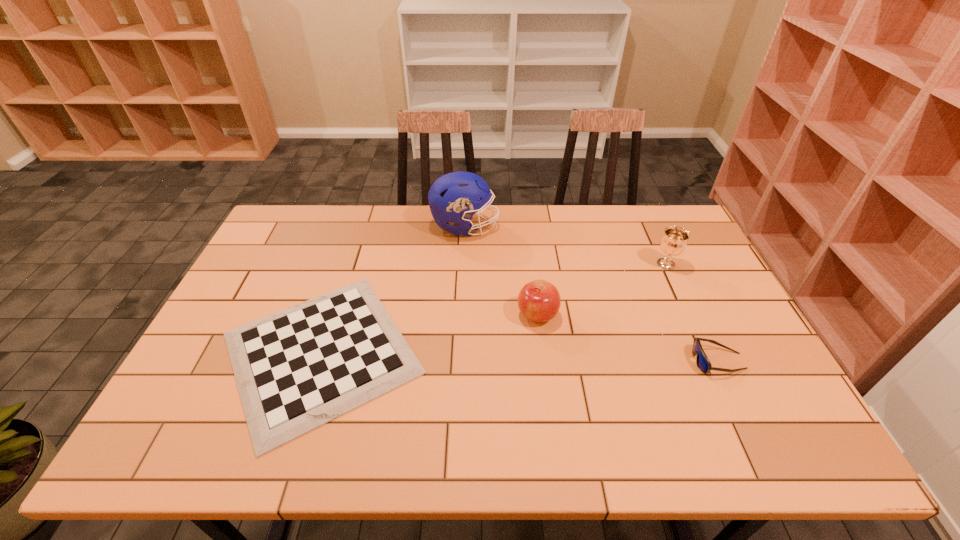
What are the coordinates of `free space that satisfies the following two spatial constraints: 1. on the front-facing side of the apple; 2. on the left side of the farthest object` in the screenshot? It's located at (461, 314).

Image resolution: width=960 pixels, height=540 pixels. I want to click on vacant area in the image that satisfies the following two spatial constraints: 1. on the front-facing side of the football helmet; 2. on the back side of the chalice, so click(x=463, y=264).